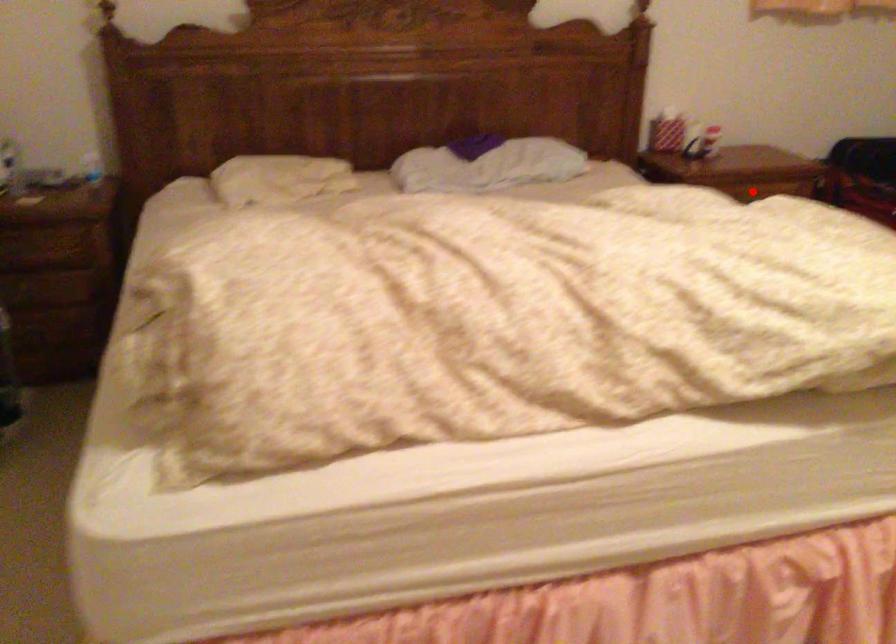
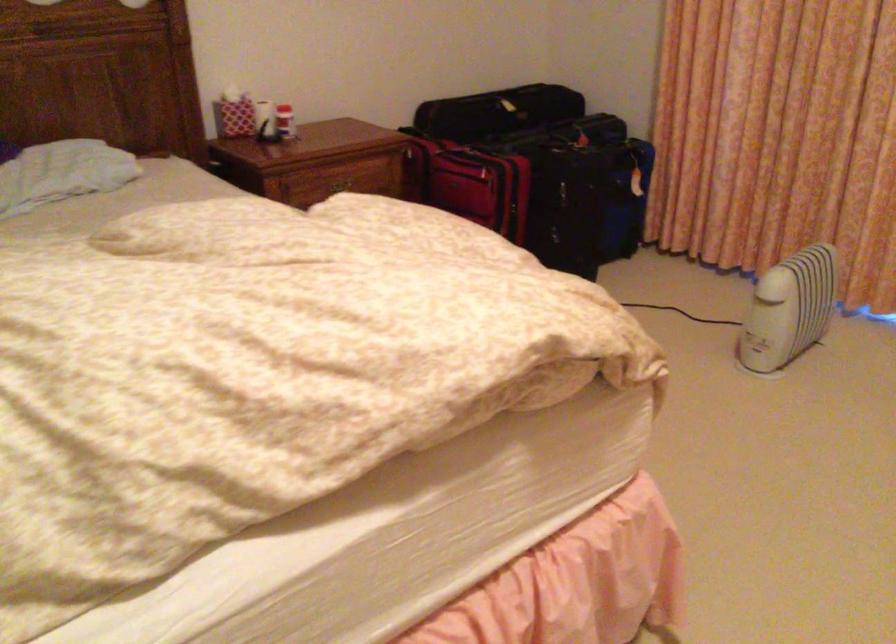
Where in the second image is the point corresponding to the highlighted location from the first image?

(338, 185)